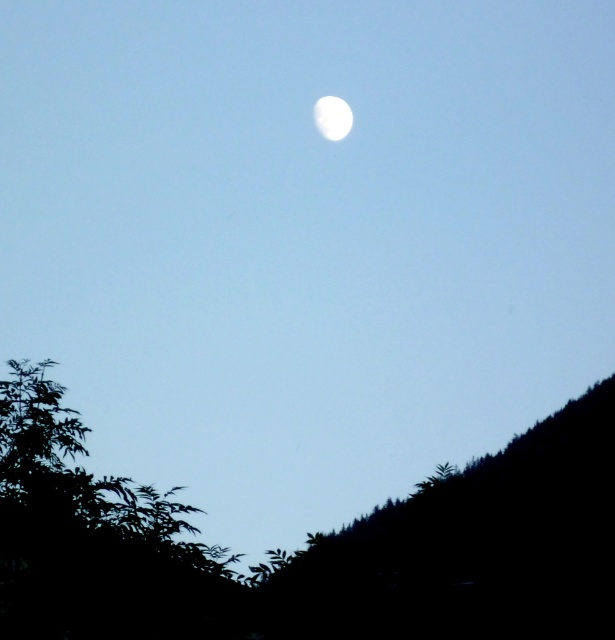
Is black matte hillside at lower right positioned at the back of green leafy tree at lower left?

No, it is in front of green leafy tree at lower left.

Can you confirm if black matte hillside at lower right is positioned above green leafy tree at lower left?

Actually, black matte hillside at lower right is below green leafy tree at lower left.

Describe the element at coordinates (474, 548) in the screenshot. I see `black matte hillside at lower right` at that location.

Where is `black matte hillside at lower right`? The image size is (615, 640). black matte hillside at lower right is located at coordinates (474, 548).

Is black matte hillside at lower right above white glossy moon at upper center?

No.

Can you confirm if black matte hillside at lower right is positioned to the right of white glossy moon at upper center?

Indeed, black matte hillside at lower right is positioned on the right side of white glossy moon at upper center.

Locate an element on the screen. This screenshot has height=640, width=615. black matte hillside at lower right is located at coordinates (474, 548).

Between green leafy tree at lower left and white glossy moon at upper center, which one is positioned higher?

Positioned higher is white glossy moon at upper center.

Consider the image. Can you confirm if green leafy tree at lower left is thinner than white glossy moon at upper center?

No, green leafy tree at lower left is not thinner than white glossy moon at upper center.

Between point (28, 477) and point (338, 125), which one is positioned behind?

Point (338, 125)

Where is `green leafy tree at lower left`? The image size is (615, 640). green leafy tree at lower left is located at coordinates (81, 477).